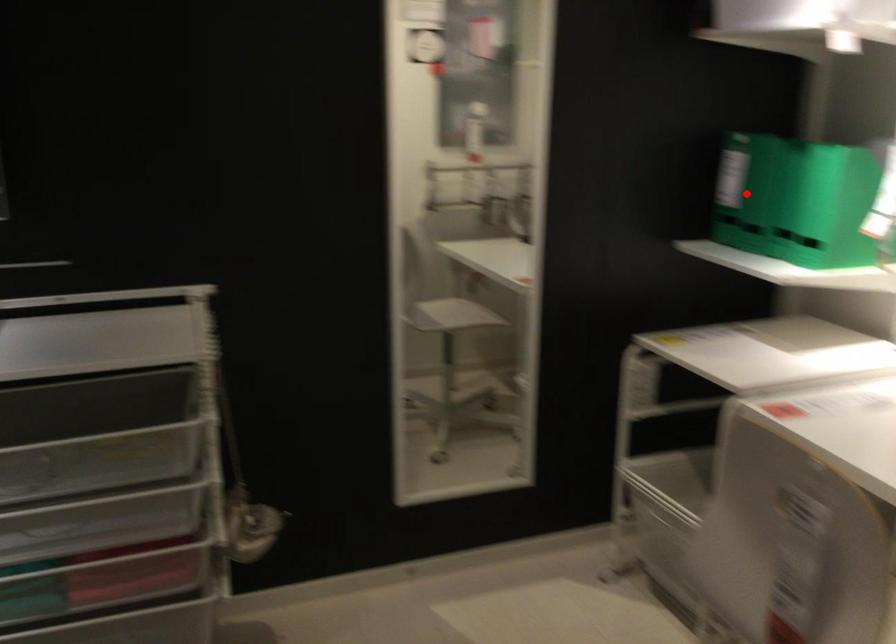
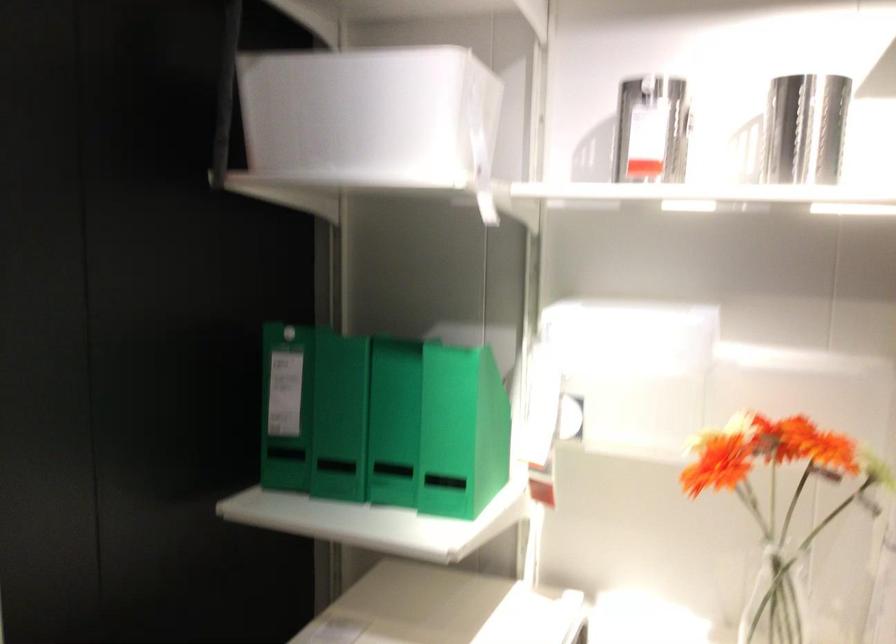
Question: I am providing you with two images of the same scene from different viewpoints. In image1, a red point is highlighted. Considering the same 3D point in image2, which of the following is correct?

Choices:
 (A) It is closer
 (B) It is farther

Answer: (A)